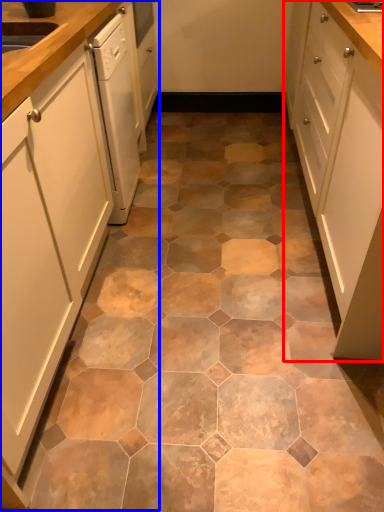
Question: Which object appears closest to the camera in this image, cabinetry (highlighted by a red box) or cabinetry (highlighted by a blue box)?

Choices:
 (A) cabinetry
 (B) cabinetry

Answer: (B)